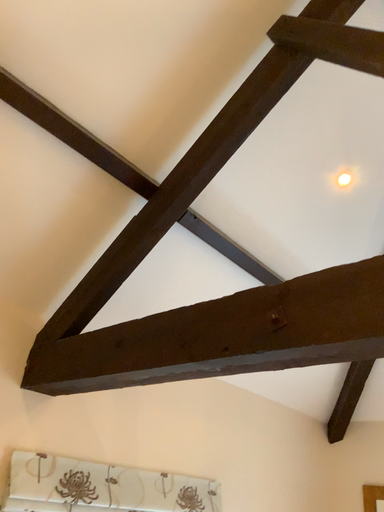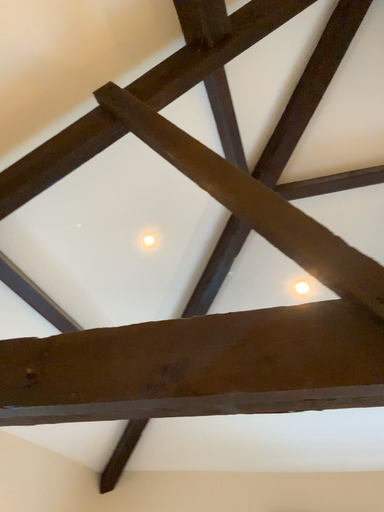
Question: How did the camera likely rotate when shooting the video?

Choices:
 (A) rotated left
 (B) rotated right

Answer: (B)